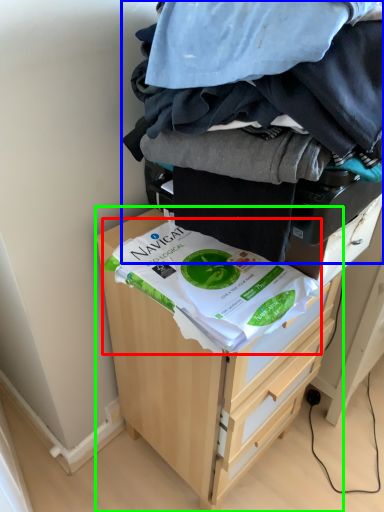
Question: Considering the real-world distances, which object is farthest from food (highlighted by a red box)? laundry (highlighted by a blue box) or chest of drawers (highlighted by a green box)?

Choices:
 (A) laundry
 (B) chest of drawers

Answer: (B)